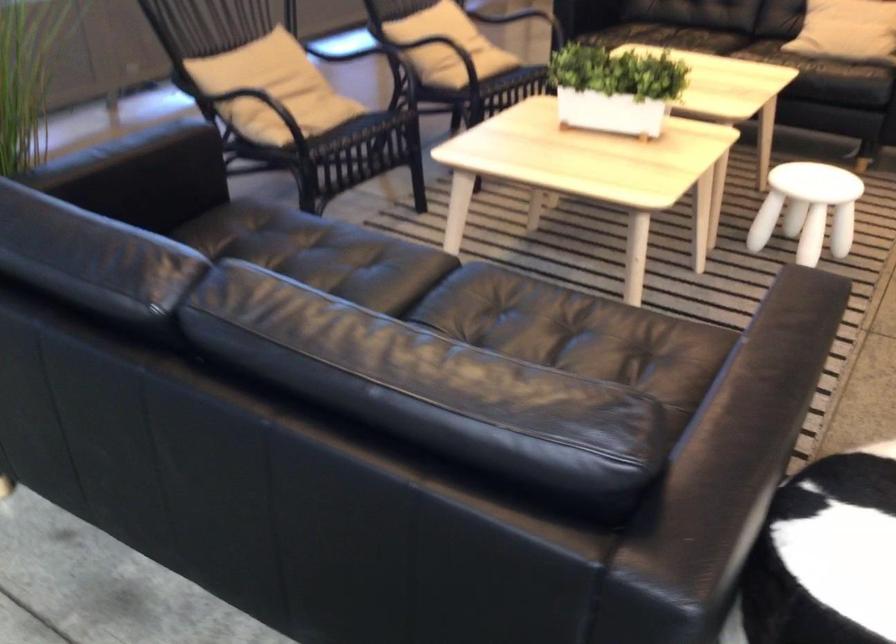
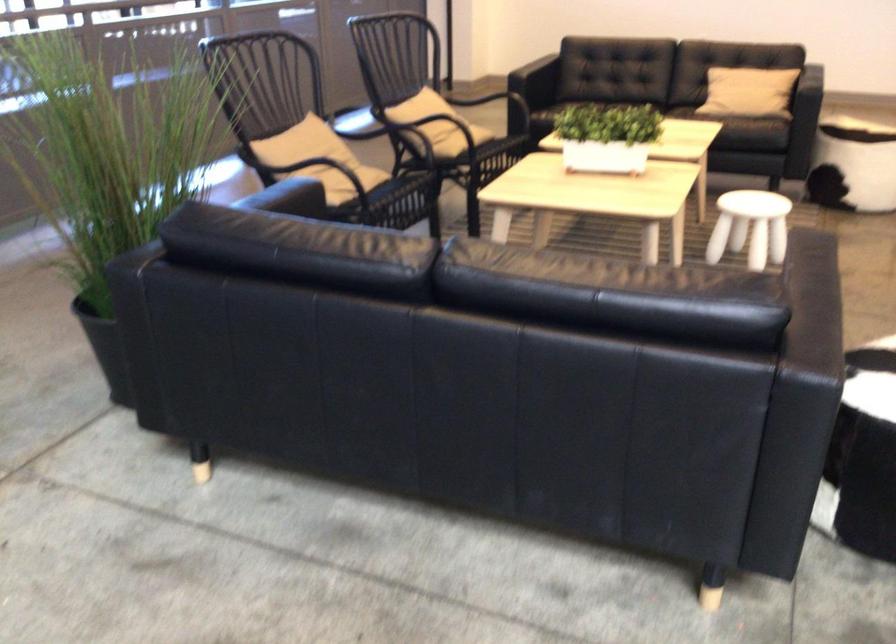
Question: I am providing you with two images of the same scene from different viewpoints. Which of the following objects are not visible in image2?

Choices:
 (A) black sofa sitting surface
 (B) black sofa armrest
 (C) black chair armrest
 (D) none of these

Answer: (D)